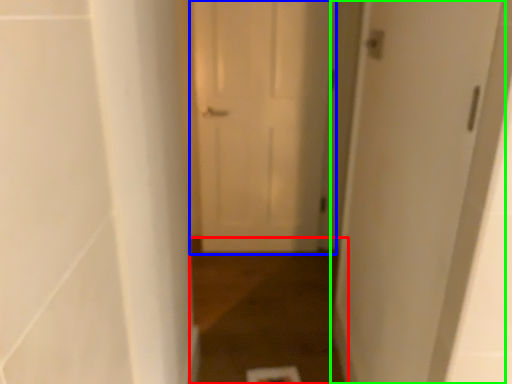
Question: Which object is the farthest from path (highlighted by a red box)? Choose among these: door (highlighted by a blue box) or door (highlighted by a green box).

Choices:
 (A) door
 (B) door

Answer: (B)